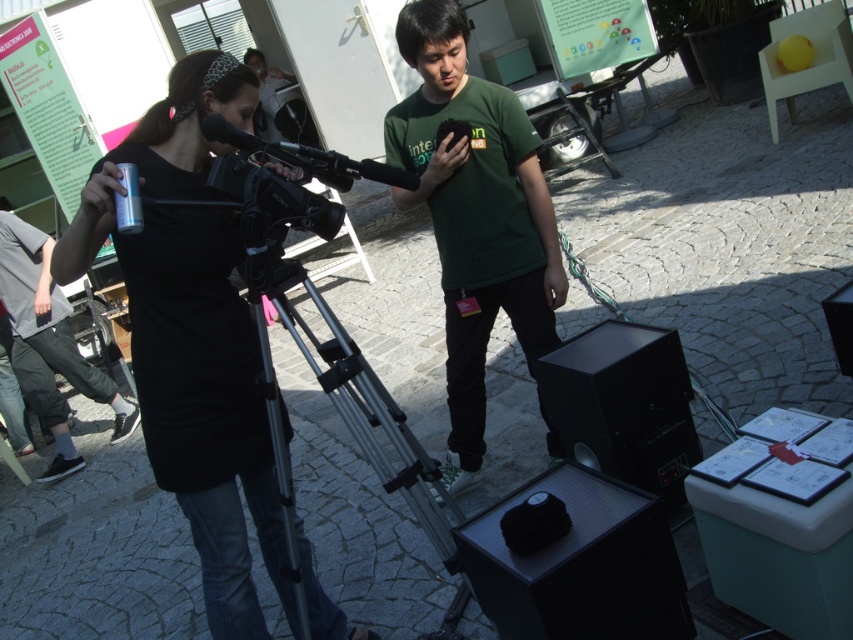
You are a camera operator standing 2 meters away from the silver metallic tripod at center. Can you safely approach the tripod without needing to move any other objects in the scene?

The silver metallic tripod at center is 1.83 meters away from the viewer, so you are currently 2 meters away. This means you are slightly farther than the tripod, so you can approach it safely without moving other objects as there is enough space between you and the tripod.

You are setting up equipment for a video shoot. You have a matte black camera at center and a silver metallic tripod at center. Which object is wider?

The matte black camera at center is wider than the silver metallic tripod at center according to the description.

You are trying to determine if the matte black camera at center can fit into a storage box that is the same width as the dark gray pants at lower left. Based on the scene, will the camera fit?

The matte black camera at center is wider than the dark gray pants at lower left, so it will not fit into a storage box with the same width as the dark gray pants at lower left.